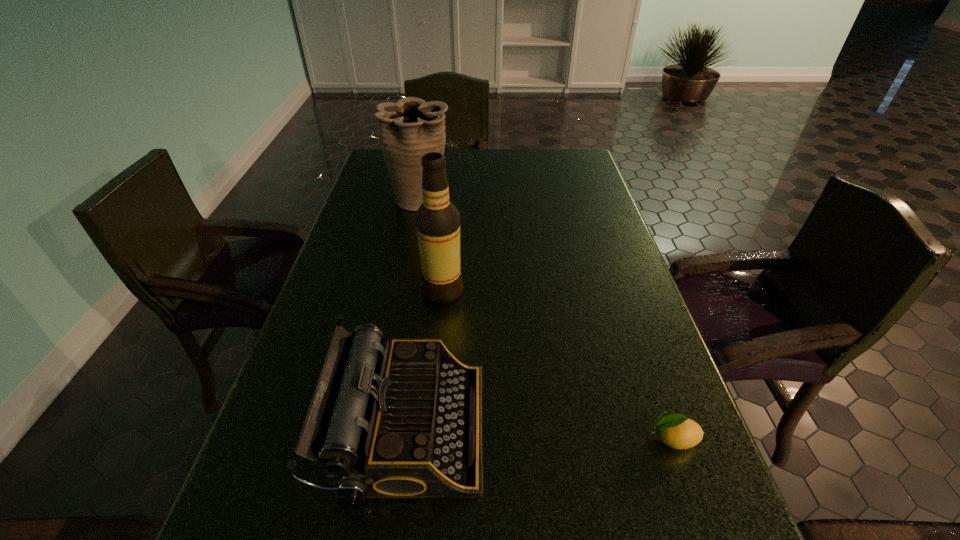
I want to click on the second farthest object, so click(437, 220).

Where is `alcohol`? alcohol is located at coordinates (437, 220).

Identify the location of the farthest object. (410, 128).

Where is `urn`? The height and width of the screenshot is (540, 960). urn is located at coordinates (410, 128).

Locate an element on the screen. This screenshot has width=960, height=540. the second shortest object is located at coordinates (405, 421).

Find the location of a particular element. lemon is located at coordinates point(677,431).

Locate an element on the screen. This screenshot has height=540, width=960. the rightmost object is located at coordinates (677, 431).

Identify the location of free location located on the label of the alcohol. (496, 291).

Locate an element on the screen. free space located on the left of the farthest object is located at coordinates (369, 199).

This screenshot has height=540, width=960. What are the coordinates of `vacant space situated on the keyboard of the second shortest object` in the screenshot? It's located at click(x=628, y=427).